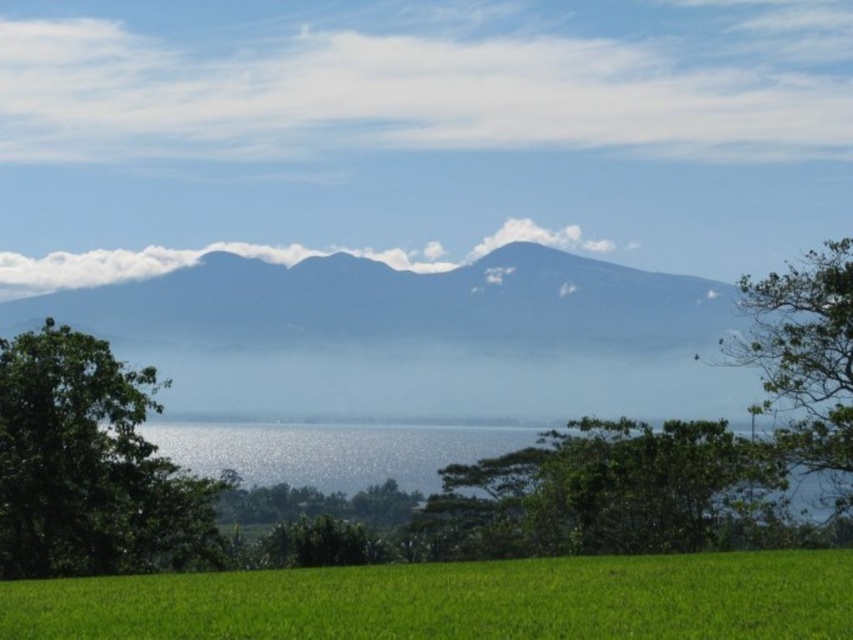
Who is positioned more to the left, green leafy tree at left or green leafy tree at center?

green leafy tree at left

Does point (140, 396) come closer to viewer compared to point (750, 492)?

No, (140, 396) is further to viewer.

Image resolution: width=853 pixels, height=640 pixels. Describe the element at coordinates (90, 467) in the screenshot. I see `green leafy tree at left` at that location.

Where is `green leafy tree at left`? The image size is (853, 640). green leafy tree at left is located at coordinates (90, 467).

Is green leafy tree at left taller than green leafy tree at right?

Yes.

Between green leafy tree at left and green leafy tree at right, which one has more height?

green leafy tree at left is taller.

Who is more forward, (146, 506) or (825, 444)?

Point (825, 444) is in front.

This screenshot has height=640, width=853. I want to click on green leafy tree at left, so click(90, 467).

Is point (460, 531) closer to camera compared to point (787, 436)?

No.

Does green leafy tree at center come behind green leafy tree at right?

Yes.

Is point (540, 486) positioned after point (825, 348)?

Yes, it is.

What are the coordinates of `green leafy tree at center` in the screenshot? It's located at (601, 492).